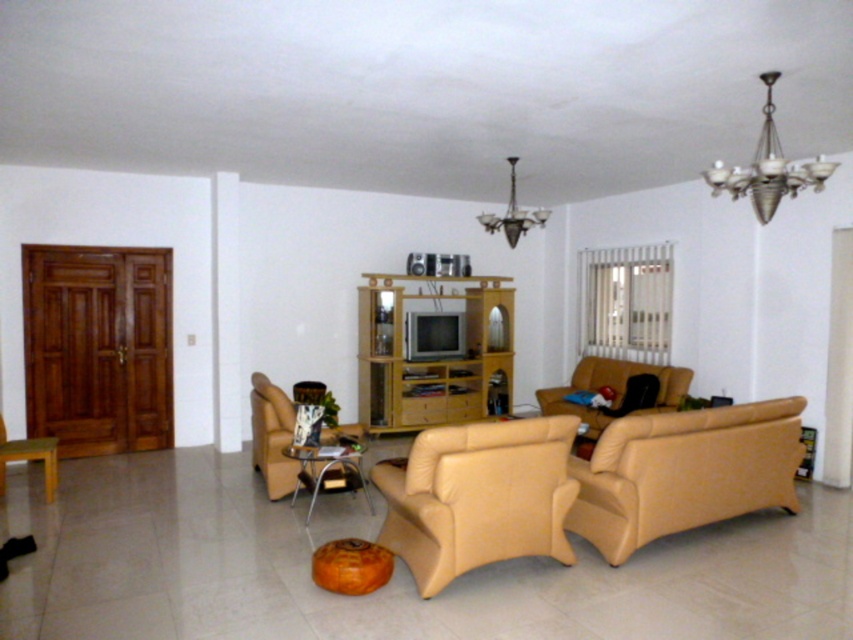
You are a visitor entering the living room and need to sit down. Which object between the beige leather armchair at center and the metallic silver chandelier at upper right is more suitable for sitting?

The beige leather armchair at center is more suitable for sitting because it has a greater height compared to the metallic silver chandelier at upper right, which is likely too low or not designed for seating.

You are standing in the living room and want to place a small table exactly at point (479, 497). According to the scene, which object is located at that point?

The beige leather armchair at center is located at point (479, 497).